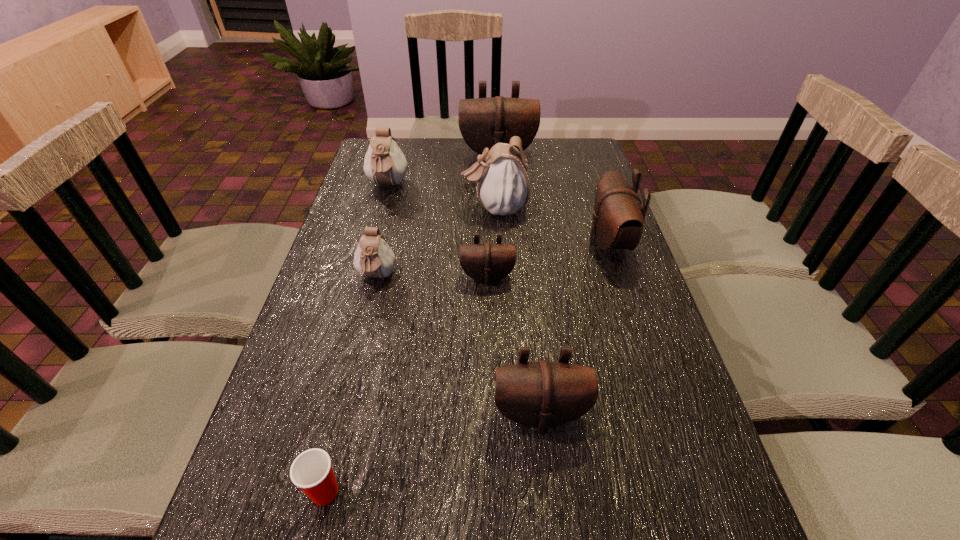
Locate which object is the second closest to the biggest brown pouch. Please provide its 2D coordinates. Your answer should be formatted as a tuple, i.e. [(x, y)], where the tuple contains the x and y coordinates of a point satisfying the conditions above.

[(503, 180)]

You are a GUI agent. You are given a task and a screenshot of the screen. Output one action in this format:
    pyautogui.click(x=<x>, y=<y>)
    Task: Click on the pouch that is the fourth closest to the nearest white pouch
    This screenshot has width=960, height=540.
    Given the screenshot: What is the action you would take?
    pyautogui.click(x=542, y=394)

I want to click on the sixth closest pouch to the rightmost brown pouch, so click(384, 163).

Identify which brown pouch is the third nearest to the smallest brown pouch. Please provide its 2D coordinates. Your answer should be formatted as a tuple, i.e. [(x, y)], where the tuple contains the x and y coordinates of a point satisfying the conditions above.

[(483, 122)]

Identify which brown pouch is located as the fourth nearest to the Dixie cup. Please provide its 2D coordinates. Your answer should be formatted as a tuple, i.e. [(x, y)], where the tuple contains the x and y coordinates of a point satisfying the conditions above.

[(483, 122)]

The image size is (960, 540). Find the location of `white pouch that is the second closest to the biggest white pouch`. white pouch that is the second closest to the biggest white pouch is located at coordinates (373, 258).

Select which white pouch is the second closest to the red Dixie cup. Please provide its 2D coordinates. Your answer should be formatted as a tuple, i.e. [(x, y)], where the tuple contains the x and y coordinates of a point satisfying the conditions above.

[(503, 180)]

Locate an element on the screen. The width and height of the screenshot is (960, 540). free space that satisfies the following two spatial constraints: 1. with the flap open on the rightmost pouch; 2. on the front-facing side of the nearest white pouch is located at coordinates (620, 278).